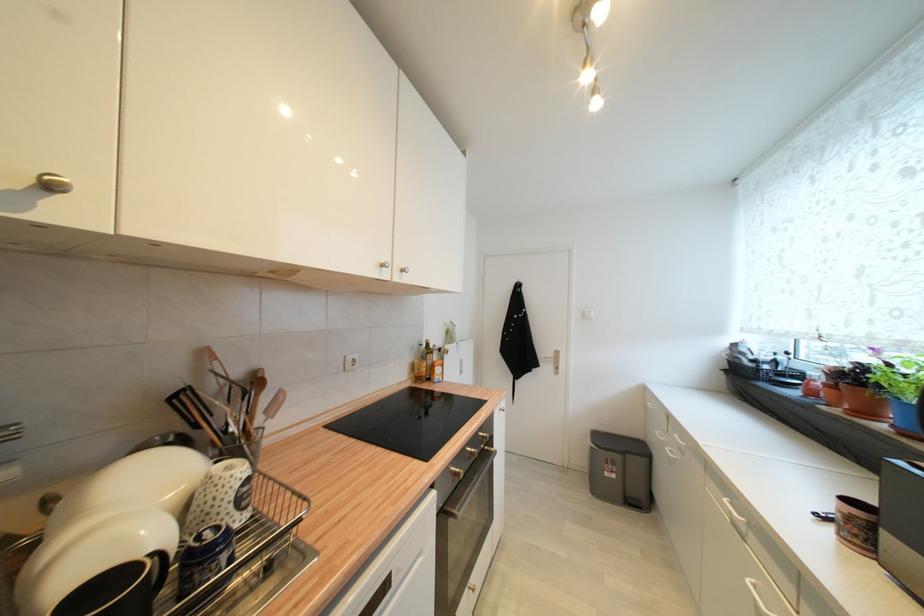
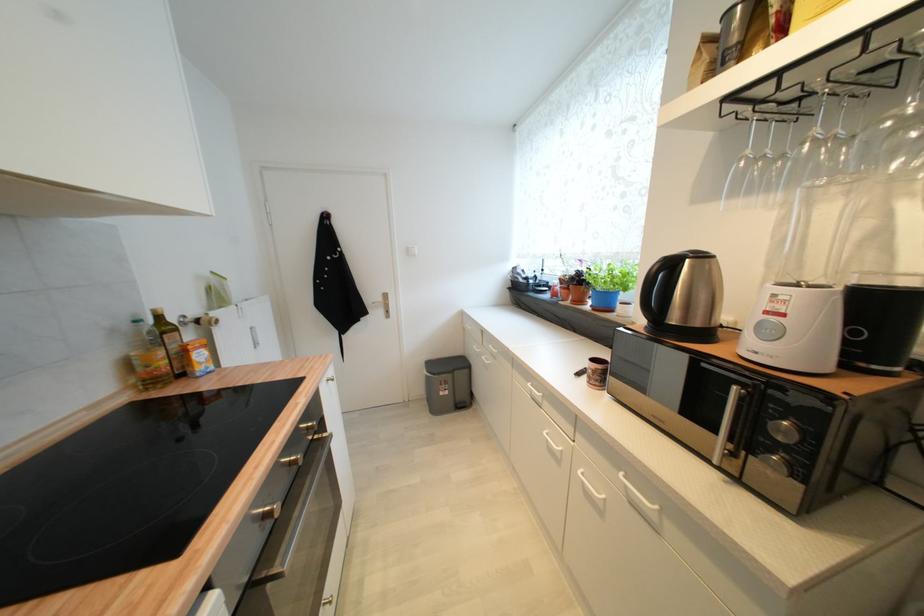
Question: The camera is either moving clockwise (left) or counter-clockwise (right) around the object. The first image is from the beginning of the video and the second image is from the end. Is the camera moving left or right when shooting the video?

Choices:
 (A) Left
 (B) Right

Answer: (A)